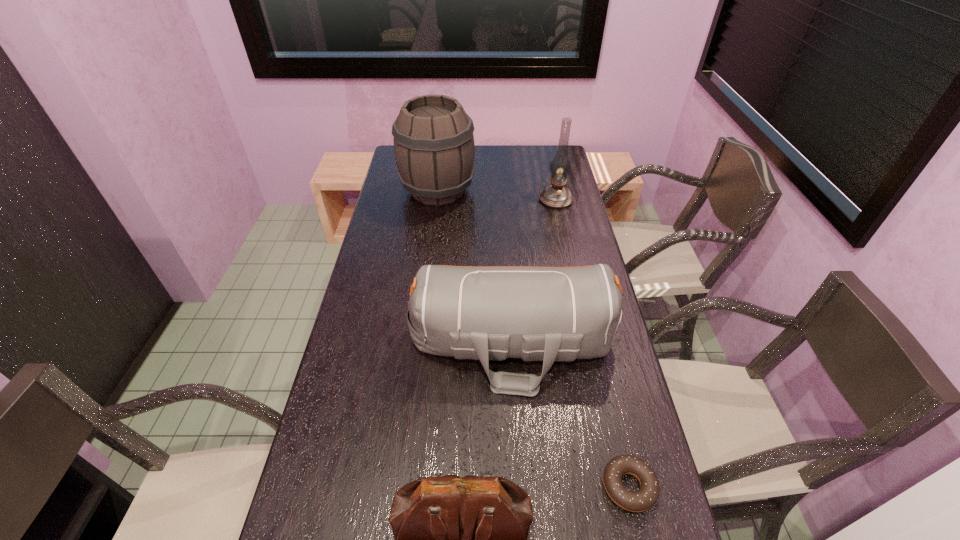
This screenshot has height=540, width=960. In order to click on oil lamp at the right edge in this screenshot , I will do `click(557, 196)`.

At what (x,y) coordinates should I click in order to perform the action: click on duffel bag that is at the right edge. Please return your answer as a coordinate pair (x, y). Looking at the image, I should click on (x=552, y=314).

The image size is (960, 540). In order to click on doughnut at the right edge in this screenshot , I will do `click(643, 499)`.

The height and width of the screenshot is (540, 960). Find the location of `object present at the far left corner`. object present at the far left corner is located at coordinates [x=434, y=148].

At what (x,y) coordinates should I click in order to perform the action: click on free region at the far edge. Please return your answer as a coordinate pair (x, y). Looking at the image, I should click on (485, 150).

This screenshot has width=960, height=540. What are the coordinates of `vacant space at the left edge` in the screenshot? It's located at (332, 437).

This screenshot has height=540, width=960. In order to click on vacant area at the right edge in this screenshot , I will do click(x=581, y=393).

The width and height of the screenshot is (960, 540). I want to click on vacant point located between the third farthest object and the doughnut, so click(x=570, y=415).

Locate an element on the screen. free space between the duffel bag and the shortest object is located at coordinates (570, 415).

Where is `empty location between the wine bucket and the oil lamp`? The height and width of the screenshot is (540, 960). empty location between the wine bucket and the oil lamp is located at coordinates 496,195.